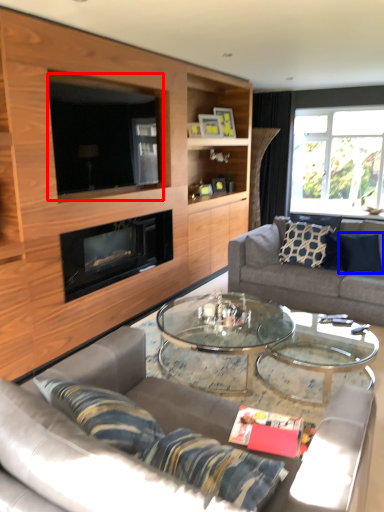
Question: Which of the following is the farthest to the observer, window screen (highlighted by a red box) or pillow (highlighted by a blue box)?

Choices:
 (A) window screen
 (B) pillow

Answer: (B)